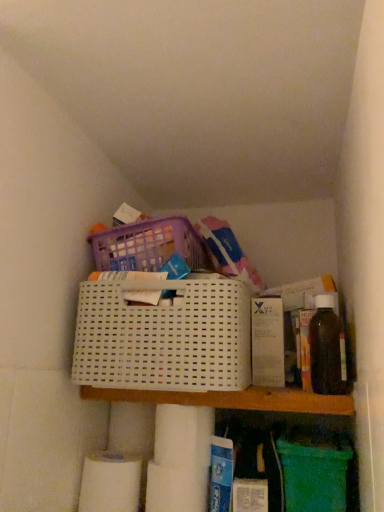
Question: From the image's perspective, is white plastic shelf at center beneath white plastic basket at center?

Choices:
 (A) yes
 (B) no

Answer: (A)

Question: Is white plastic shelf at center located outside white plastic basket at center?

Choices:
 (A) yes
 (B) no

Answer: (A)

Question: Is white plastic shelf at center bigger than white plastic basket at center?

Choices:
 (A) yes
 (B) no

Answer: (B)

Question: Is white plastic shelf at center closer to the viewer compared to white plastic basket at center?

Choices:
 (A) yes
 (B) no

Answer: (B)

Question: Is white plastic shelf at center taller than white plastic basket at center?

Choices:
 (A) no
 (B) yes

Answer: (A)

Question: Is white plastic shelf at center beside white plastic basket at center?

Choices:
 (A) no
 (B) yes

Answer: (B)

Question: Is translucent amber bottle at right in front of white plastic basket at center?

Choices:
 (A) yes
 (B) no

Answer: (B)

Question: Does translucent amber bottle at right have a greater width compared to white plastic basket at center?

Choices:
 (A) yes
 (B) no

Answer: (B)

Question: From a real-world perspective, is translucent amber bottle at right physically above white plastic basket at center?

Choices:
 (A) yes
 (B) no

Answer: (A)

Question: Is translucent amber bottle at right taller than white plastic basket at center?

Choices:
 (A) no
 (B) yes

Answer: (A)

Question: Is translucent amber bottle at right behind white plastic basket at center?

Choices:
 (A) yes
 (B) no

Answer: (A)

Question: Can you confirm if translucent amber bottle at right is bigger than white plastic basket at center?

Choices:
 (A) no
 (B) yes

Answer: (A)

Question: Is translucent amber bottle at right to the left of white plastic shelf at center from the viewer's perspective?

Choices:
 (A) no
 (B) yes

Answer: (A)